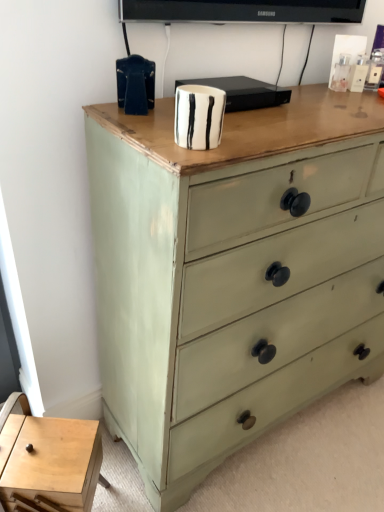
Question: Is sage green painted wood chest of drawers at center in front of or behind light wood table at lower left in the image?

Choices:
 (A) front
 (B) behind

Answer: (A)

Question: From the image's perspective, relative to light wood table at lower left, is sage green painted wood chest of drawers at center above or below?

Choices:
 (A) below
 (B) above

Answer: (B)

Question: From a real-world perspective, relative to light wood table at lower left, is sage green painted wood chest of drawers at center vertically above or below?

Choices:
 (A) above
 (B) below

Answer: (A)

Question: Is light wood table at lower left wider or thinner than sage green painted wood chest of drawers at center?

Choices:
 (A) thin
 (B) wide

Answer: (A)

Question: Does point click(x=71, y=463) appear closer or farther from the camera than point click(x=357, y=316)?

Choices:
 (A) closer
 (B) farther

Answer: (A)

Question: Is light wood table at lower left situated inside sage green painted wood chest of drawers at center or outside?

Choices:
 (A) outside
 (B) inside

Answer: (A)

Question: From the image's perspective, is light wood table at lower left positioned above or below sage green painted wood chest of drawers at center?

Choices:
 (A) above
 (B) below

Answer: (B)